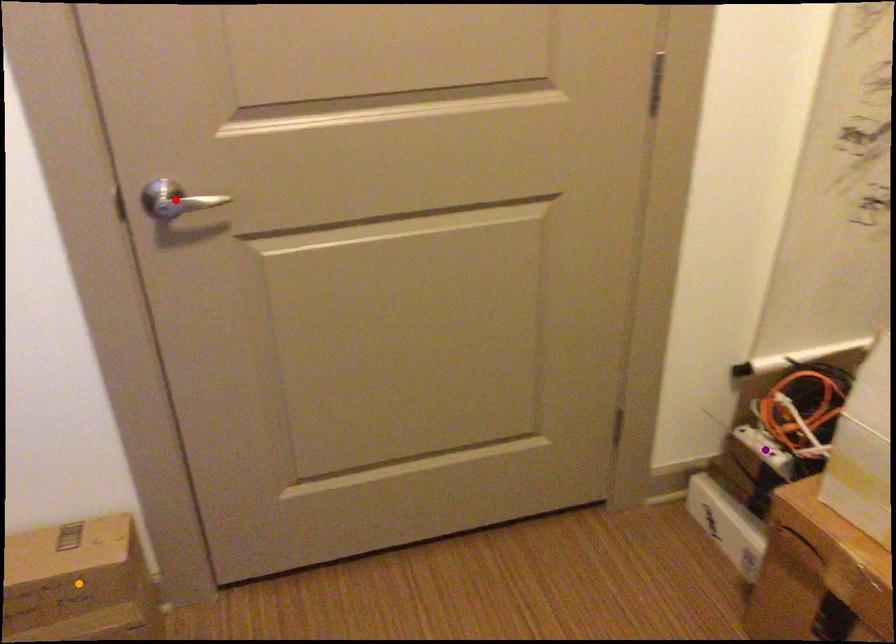
Order these from nearest to farthest:
orange point, red point, purple point

red point, orange point, purple point